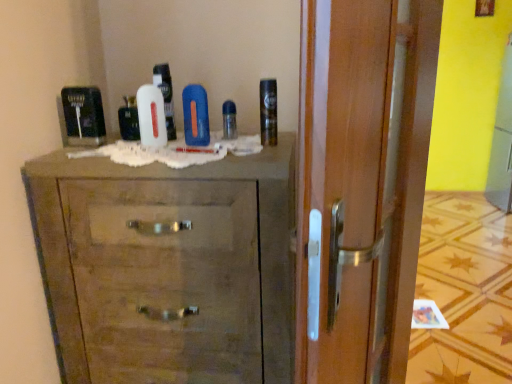
The image size is (512, 384). In order to click on free location to the left of white matte shaving cream at center, which is the first shaving cream from left to right in this screenshot , I will do `click(115, 144)`.